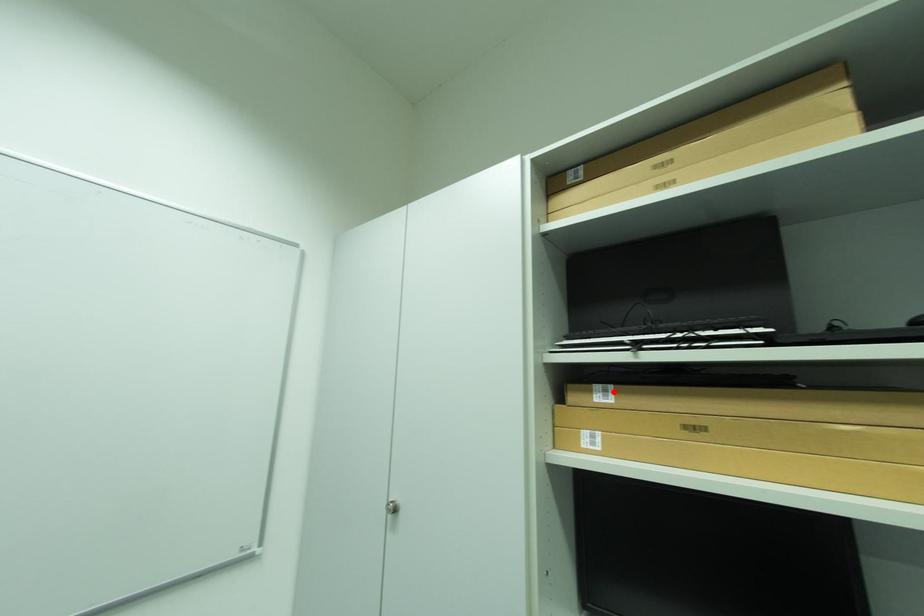
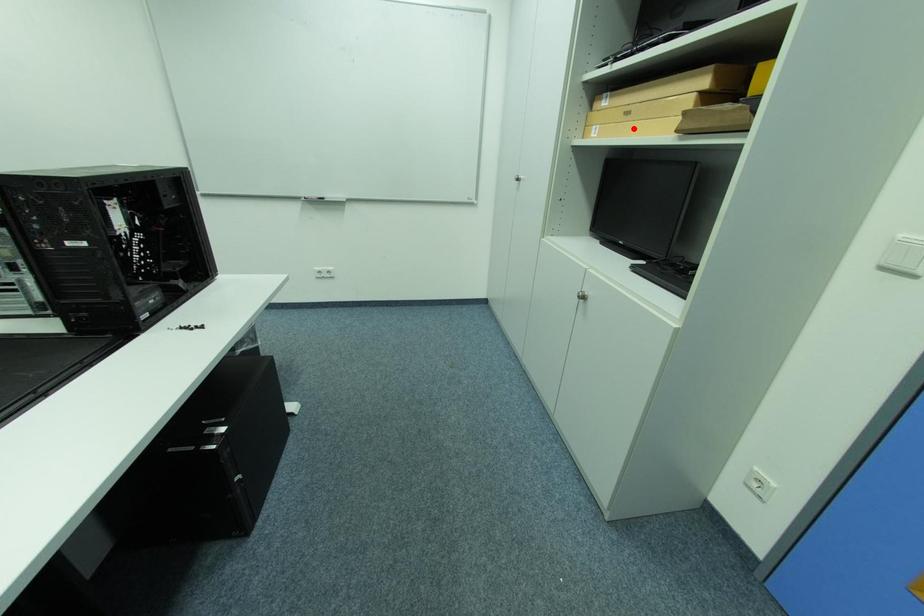
I am providing you with two images of the same scene from different viewpoints. A red point is marked on the first image and another point is marked on the second image. Are the points marked in image1 and image2 representing the same 3D position?

No